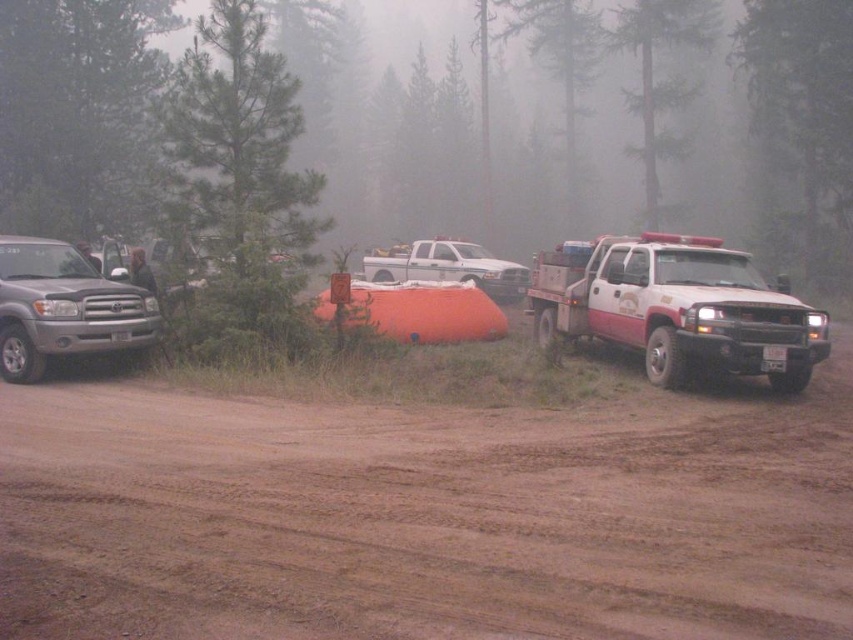
Question: Does white matte tow truck at right appear over satin silver truck at left?

Choices:
 (A) no
 (B) yes

Answer: (A)

Question: Considering the real-world distances, which object is closest to the satin silver truck at left?

Choices:
 (A) white matte tow truck at right
 (B) white matte truck at center

Answer: (A)

Question: Among these objects, which one is farthest from the camera?

Choices:
 (A) satin silver truck at left
 (B) green textured pine forest at center
 (C) dull brown dirt at center
 (D) white matte truck at center

Answer: (D)

Question: Does green textured pine forest at center lie in front of white matte tow truck at right?

Choices:
 (A) no
 (B) yes

Answer: (A)

Question: Which object is closer to the camera taking this photo?

Choices:
 (A) green textured pine forest at center
 (B) white matte tow truck at right

Answer: (B)

Question: Is dull brown dirt at center bigger than white matte truck at center?

Choices:
 (A) no
 (B) yes

Answer: (A)